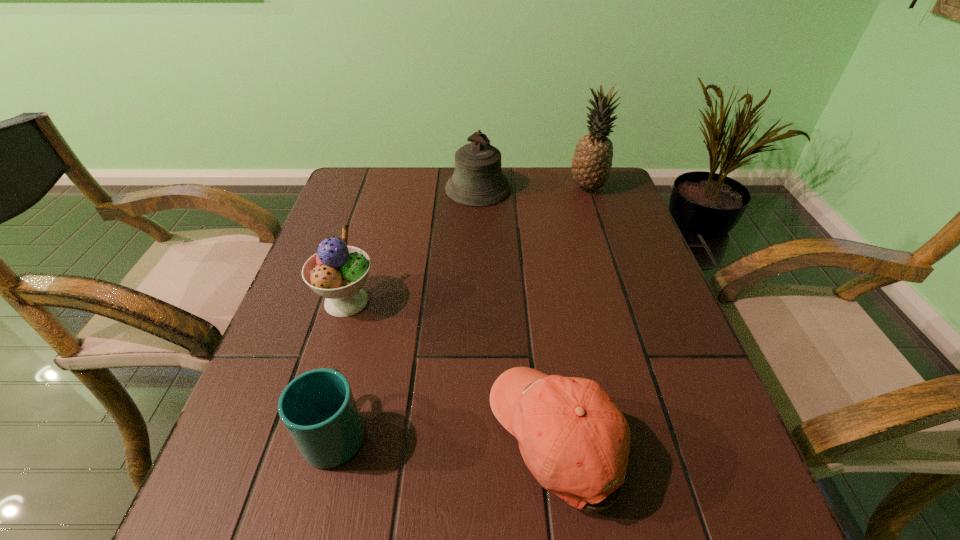
This screenshot has height=540, width=960. Identify the location of the rightmost object. (591, 164).

Locate an element on the screen. The width and height of the screenshot is (960, 540). the tallest object is located at coordinates (591, 164).

Where is `bell`? This screenshot has width=960, height=540. bell is located at coordinates (477, 181).

I want to click on icecream, so click(x=337, y=272).

The height and width of the screenshot is (540, 960). In order to click on baseball cap in this screenshot , I will do `click(559, 422)`.

At what (x,y) coordinates should I click in order to perform the action: click on cup. Please return your answer as a coordinate pair (x, y). This screenshot has width=960, height=540. Looking at the image, I should click on (318, 409).

You are a GUI agent. You are given a task and a screenshot of the screen. Output one action in this format:
    pyautogui.click(x=<x>, y=<y>)
    Task: Click on the vacant area located 0.230m on the left of the pineapple
    This screenshot has width=960, height=540.
    Given the screenshot: What is the action you would take?
    pyautogui.click(x=490, y=187)

The width and height of the screenshot is (960, 540). In order to click on free space located on the left of the bell in this screenshot , I will do `click(397, 188)`.

Locate an element on the screen. The height and width of the screenshot is (540, 960). vacant space located on the back of the icecream is located at coordinates (376, 204).

Where is `free space located on the back of the baseball cap`? free space located on the back of the baseball cap is located at coordinates (545, 338).